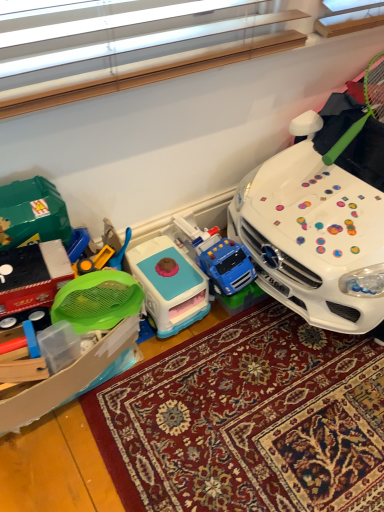
Question: Can you confirm if green mesh strainer at left, which is the first toy from left to right, is smaller than carpeted rug at center?

Choices:
 (A) no
 (B) yes

Answer: (B)

Question: From a real-world perspective, is green mesh strainer at left, which is the first toy from left to right, on carpeted rug at center?

Choices:
 (A) yes
 (B) no

Answer: (A)

Question: Is green mesh strainer at left, which is the first toy from left to right, taller than carpeted rug at center?

Choices:
 (A) no
 (B) yes

Answer: (B)

Question: Does green mesh strainer at left, which is the first toy from left to right, have a larger size compared to carpeted rug at center?

Choices:
 (A) no
 (B) yes

Answer: (A)

Question: Does green mesh strainer at left, which is the first toy from left to right, have a lesser height compared to carpeted rug at center?

Choices:
 (A) yes
 (B) no

Answer: (B)

Question: Does green mesh strainer at left, which is the first toy from left to right, have a lesser width compared to carpeted rug at center?

Choices:
 (A) no
 (B) yes

Answer: (B)

Question: Does green mesh strainer at left, the third toy when ordered from right to left, have a lesser height compared to blue plastic play kitchen at center, which is the second toy in right-to-left order?

Choices:
 (A) yes
 (B) no

Answer: (B)

Question: Can you see green mesh strainer at left, which is the first toy from left to right, touching blue plastic play kitchen at center, which is the second toy in right-to-left order?

Choices:
 (A) yes
 (B) no

Answer: (B)

Question: From the image's perspective, would you say green mesh strainer at left, which is the first toy from left to right, is positioned over blue plastic play kitchen at center, arranged as the 2th toy when viewed from the left?

Choices:
 (A) no
 (B) yes

Answer: (A)

Question: Is there a large distance between green mesh strainer at left, which is the first toy from left to right, and blue plastic play kitchen at center, which is the second toy in right-to-left order?

Choices:
 (A) no
 (B) yes

Answer: (A)

Question: Considering the relative sizes of green mesh strainer at left, which is the first toy from left to right, and blue plastic play kitchen at center, arranged as the 2th toy when viewed from the left, in the image provided, is green mesh strainer at left, which is the first toy from left to right, taller than blue plastic play kitchen at center, arranged as the 2th toy when viewed from the left,?

Choices:
 (A) no
 (B) yes

Answer: (B)

Question: From the image's perspective, is green mesh strainer at left, which is the first toy from left to right, below blue plastic play kitchen at center, arranged as the 2th toy when viewed from the left?

Choices:
 (A) yes
 (B) no

Answer: (A)

Question: From a real-world perspective, is carpeted rug at center physically below green mesh strainer at left, the third toy when ordered from right to left?

Choices:
 (A) yes
 (B) no

Answer: (A)